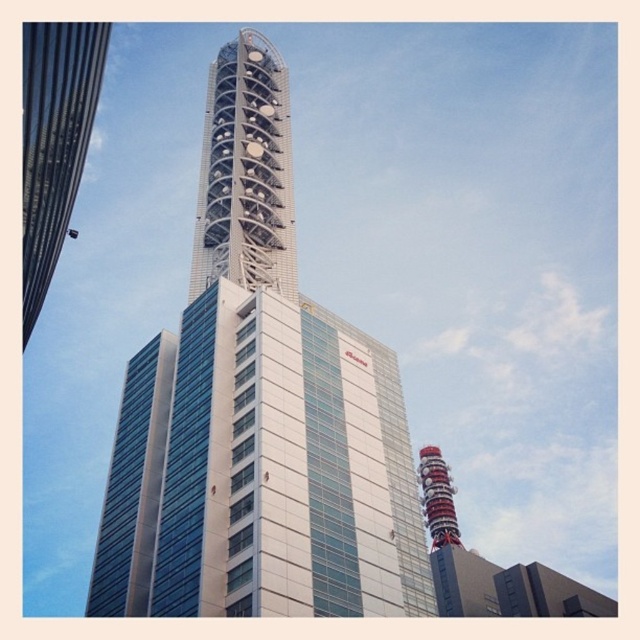
Is white metallic tower at center below glassy steel skyscraper at left?

Actually, white metallic tower at center is above glassy steel skyscraper at left.

Who is positioned more to the left, white metallic tower at center or glassy steel skyscraper at left?

Positioned to the left is glassy steel skyscraper at left.

The width and height of the screenshot is (640, 640). What do you see at coordinates (244, 172) in the screenshot?
I see `white metallic tower at center` at bounding box center [244, 172].

Where is `white metallic tower at center`? white metallic tower at center is located at coordinates (244, 172).

Looking at this image, who is higher up, white glass tower at center or glassy steel skyscraper at left?

glassy steel skyscraper at left is above.

Is white glass tower at center wider than glassy steel skyscraper at left?

Indeed, white glass tower at center has a greater width compared to glassy steel skyscraper at left.

This screenshot has width=640, height=640. Identify the location of white glass tower at center. (257, 412).

Is point (301, 326) in front of point (253, 96)?

Yes, it is in front of point (253, 96).

Can you confirm if white glass tower at center is positioned below white metallic tower at center?

Correct, white glass tower at center is located below white metallic tower at center.

Who is more distant from viewer, (248, 260) or (209, 260)?

Positioned behind is point (209, 260).

What are the coordinates of `white glass tower at center` in the screenshot? It's located at (257, 412).